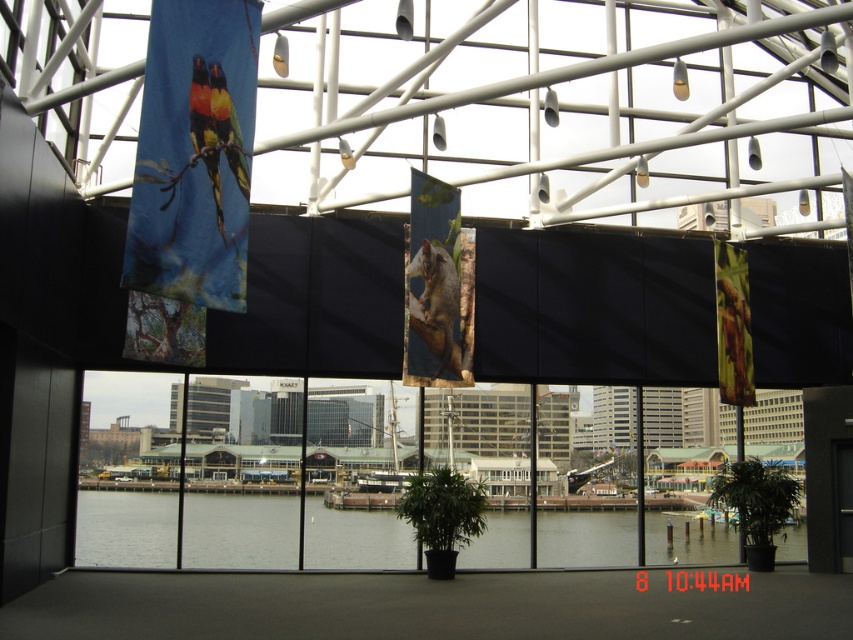
Is clear water at lower center closer to camera compared to multicolored fabric parrot at upper left?

No, it is not.

Describe the element at coordinates (239, 531) in the screenshot. I see `clear water at lower center` at that location.

Is point (77, 561) closer to camera compared to point (160, 179)?

No.

Find the location of a particular element. Image resolution: width=853 pixels, height=640 pixels. clear water at lower center is located at coordinates (239, 531).

Is blue fabric birds at left shorter than multicolored fabric parrot at upper left?

No.

Who is more forward, (x=206, y=253) or (x=209, y=125)?

Point (x=206, y=253) is in front.

Is point (160, 80) closer to viewer compared to point (216, 209)?

That is True.

What are the coordinates of `blue fabric birds at left` in the screenshot? It's located at (194, 154).

Which is below, blue fabric birds at left or clear water at lower center?

Positioned lower is clear water at lower center.

Between point (149, 129) and point (196, 513), which one is positioned in front?

Point (149, 129) is in front.

The height and width of the screenshot is (640, 853). I want to click on blue fabric birds at left, so click(x=194, y=154).